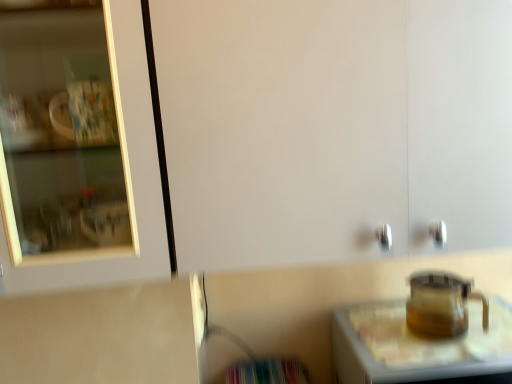
Question: Is transparent glass table at lower right closer to camera compared to transparent glass teapot at lower right?

Choices:
 (A) yes
 (B) no

Answer: (A)

Question: Does transparent glass table at lower right have a greater height compared to transparent glass teapot at lower right?

Choices:
 (A) no
 (B) yes

Answer: (B)

Question: Does transparent glass table at lower right lie behind transparent glass teapot at lower right?

Choices:
 (A) no
 (B) yes

Answer: (A)

Question: Is transparent glass teapot at lower right completely or partially inside transparent glass table at lower right?

Choices:
 (A) yes
 (B) no

Answer: (B)

Question: Are transparent glass table at lower right and transparent glass teapot at lower right far apart?

Choices:
 (A) yes
 (B) no

Answer: (B)

Question: Does transparent glass table at lower right have a greater width compared to transparent glass teapot at lower right?

Choices:
 (A) no
 (B) yes

Answer: (B)

Question: From the image's perspective, does transparent glass teapot at lower right appear lower than transparent glass table at lower right?

Choices:
 (A) no
 (B) yes

Answer: (A)

Question: Is transparent glass teapot at lower right smaller than transparent glass table at lower right?

Choices:
 (A) yes
 (B) no

Answer: (A)

Question: Is transparent glass teapot at lower right closer to the viewer compared to transparent glass table at lower right?

Choices:
 (A) no
 (B) yes

Answer: (A)

Question: Does transparent glass teapot at lower right lie behind transparent glass table at lower right?

Choices:
 (A) yes
 (B) no

Answer: (A)

Question: From a real-world perspective, is transparent glass teapot at lower right beneath transparent glass table at lower right?

Choices:
 (A) yes
 (B) no

Answer: (B)

Question: Is transparent glass teapot at lower right facing away from transparent glass table at lower right?

Choices:
 (A) yes
 (B) no

Answer: (B)

Question: Is transparent glass table at lower right taller or shorter than transparent glass teapot at lower right?

Choices:
 (A) short
 (B) tall

Answer: (B)